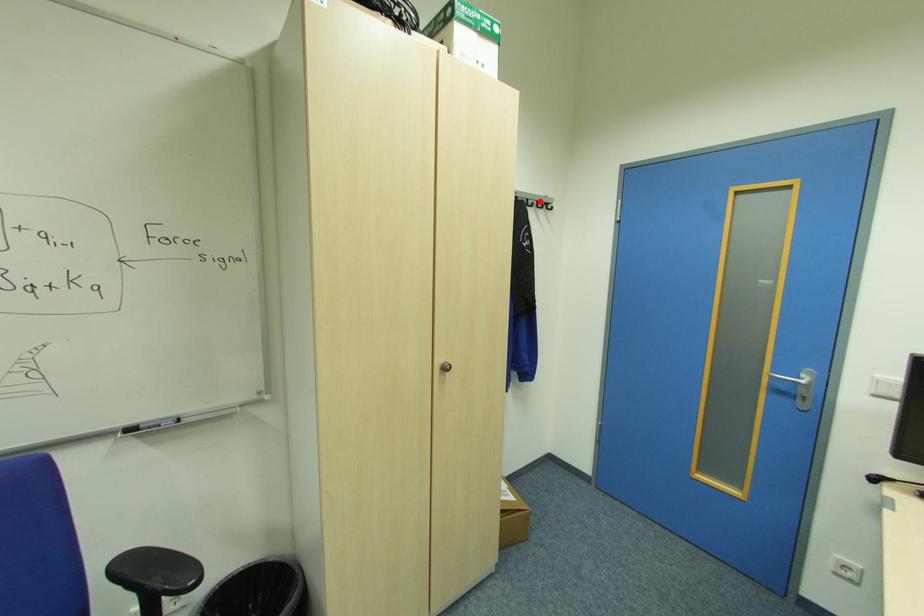
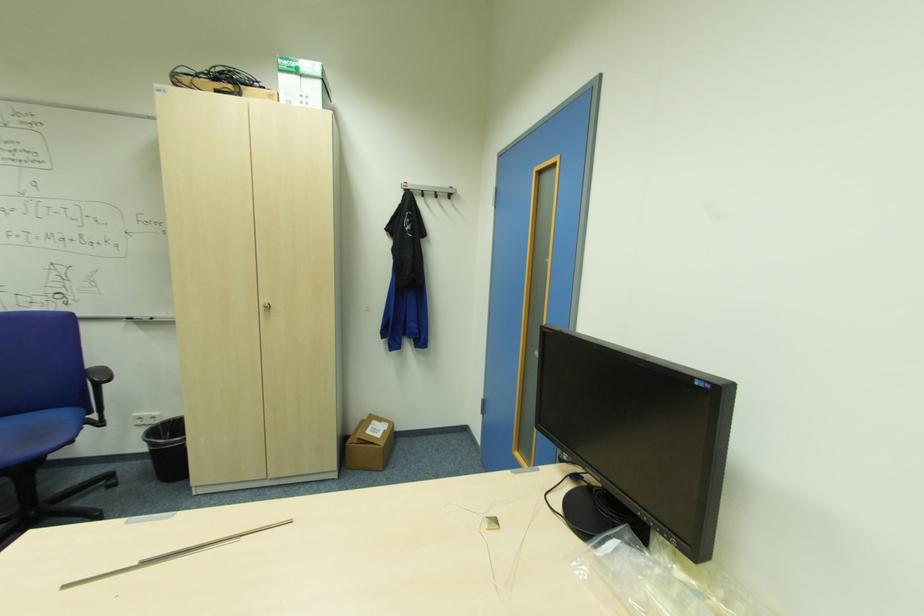
Find the pixel in the second image that matches the highlighted location in the first image.

(439, 192)